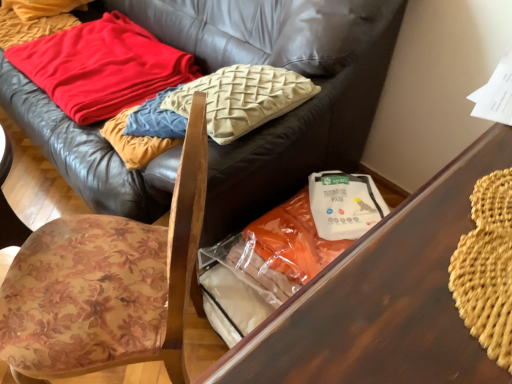
Question: Is red soft fabric blanket at upper left outside wooden table at center?

Choices:
 (A) no
 (B) yes

Answer: (B)

Question: Considering the relative sizes of red soft fabric blanket at upper left and wooden table at center in the image provided, is red soft fabric blanket at upper left bigger than wooden table at center?

Choices:
 (A) no
 (B) yes

Answer: (A)

Question: Is red soft fabric blanket at upper left shorter than wooden table at center?

Choices:
 (A) no
 (B) yes

Answer: (B)

Question: From the image's perspective, is red soft fabric blanket at upper left above wooden table at center?

Choices:
 (A) yes
 (B) no

Answer: (A)

Question: From a real-world perspective, is red soft fabric blanket at upper left beneath wooden table at center?

Choices:
 (A) no
 (B) yes

Answer: (B)

Question: Is red soft fabric blanket at upper left oriented towards wooden table at center?

Choices:
 (A) yes
 (B) no

Answer: (B)

Question: From the image's perspective, is red soft fabric blanket at upper left under floral fabric chair at left?

Choices:
 (A) yes
 (B) no

Answer: (B)

Question: Is red soft fabric blanket at upper left to the left of floral fabric chair at left from the viewer's perspective?

Choices:
 (A) no
 (B) yes

Answer: (B)

Question: Are red soft fabric blanket at upper left and floral fabric chair at left beside each other?

Choices:
 (A) yes
 (B) no

Answer: (B)

Question: Considering the relative positions of red soft fabric blanket at upper left and floral fabric chair at left in the image provided, is red soft fabric blanket at upper left to the right of floral fabric chair at left from the viewer's perspective?

Choices:
 (A) yes
 (B) no

Answer: (B)

Question: Considering the relative sizes of red soft fabric blanket at upper left and floral fabric chair at left in the image provided, is red soft fabric blanket at upper left wider than floral fabric chair at left?

Choices:
 (A) no
 (B) yes

Answer: (B)

Question: Is red soft fabric blanket at upper left completely or partially outside of floral fabric chair at left?

Choices:
 (A) yes
 (B) no

Answer: (A)

Question: Considering the relative sizes of leather couch at upper center and floral fabric chair at left in the image provided, is leather couch at upper center thinner than floral fabric chair at left?

Choices:
 (A) no
 (B) yes

Answer: (A)